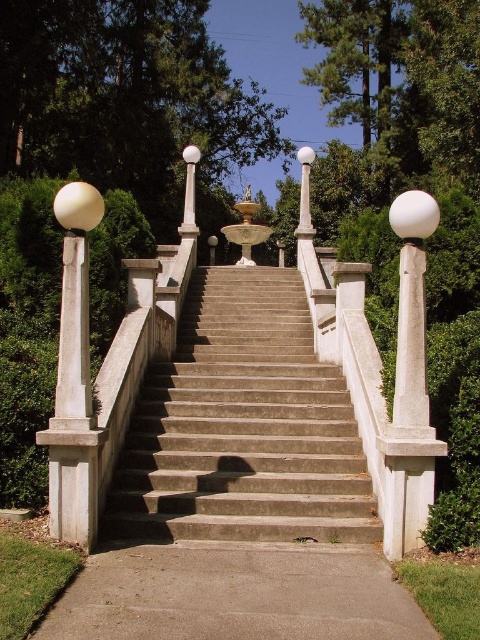
Question: Does concrete stairs at center appear on the right side of gray concrete sidewalk at lower center?

Choices:
 (A) yes
 (B) no

Answer: (B)

Question: Is concrete stairs at center above green leafy tree at upper center?

Choices:
 (A) no
 (B) yes

Answer: (A)

Question: Among these points, which one is nearest to the camera?

Choices:
 (A) (157, 163)
 (B) (337, 515)
 (C) (82, 577)

Answer: (C)

Question: Which point appears closest to the camera in this image?

Choices:
 (A) (220, 634)
 (B) (189, 44)

Answer: (A)

Question: Does green leafy tree at upper center have a greater width compared to gray concrete sidewalk at lower center?

Choices:
 (A) yes
 (B) no

Answer: (A)

Question: Which of the following is the farthest from the observer?

Choices:
 (A) (190, 496)
 (B) (48, 72)

Answer: (B)